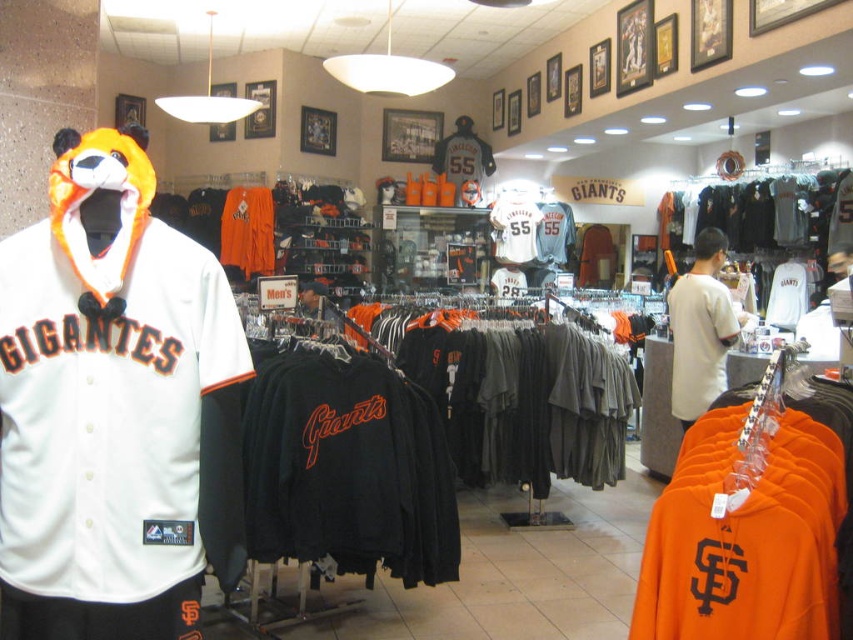
Is white jersey at left further to the viewer compared to white cotton t-shirt at center?

That is False.

Is white jersey at left to the left of white cotton t-shirt at center from the viewer's perspective?

Indeed, white jersey at left is positioned on the left side of white cotton t-shirt at center.

Is point (113, 516) in front of point (683, 406)?

Yes, point (113, 516) is closer to viewer.

This screenshot has height=640, width=853. Find the location of `white jersey at left`. white jersey at left is located at coordinates (117, 424).

Which is in front, point (32, 516) or point (253, 248)?

Point (32, 516) is more forward.

Where is `white jersey at left`? The height and width of the screenshot is (640, 853). white jersey at left is located at coordinates (117, 424).

Is point (396, 353) more distant than point (717, 330)?

Yes.

Find the location of a particular element. The height and width of the screenshot is (640, 853). black jersey at center is located at coordinates (514, 394).